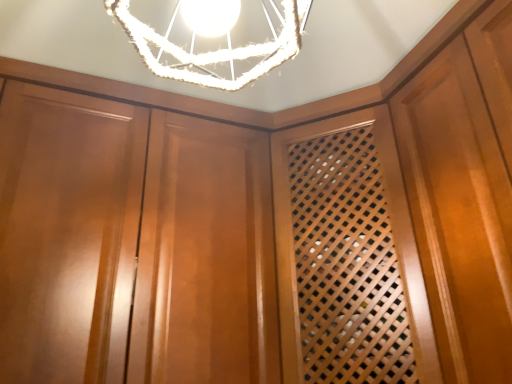
Measure the distance between point (277, 42) and camera.

Point (277, 42) is 39.13 inches away from camera.

Describe the element at coordinates (217, 50) in the screenshot. This screenshot has height=384, width=512. I see `white textured lampshade at upper center` at that location.

Where is `white textured lampshade at upper center`? This screenshot has height=384, width=512. white textured lampshade at upper center is located at coordinates (217, 50).

The image size is (512, 384). I want to click on glossy wood cabinetry at center, so click(132, 245).

What do you see at coordinates (132, 245) in the screenshot? I see `glossy wood cabinetry at center` at bounding box center [132, 245].

In order to face glossy wood cabinetry at center, should I rotate leftwards or rightwards?

Rotate left and turn 16.931 degrees.

At what (x,y) coordinates should I click in order to perform the action: click on white textured lampshade at upper center. Please return your answer as a coordinate pair (x, y). Looking at the image, I should click on (217, 50).

Visually, is glossy wood cabinetry at center positioned to the left or to the right of white textured lampshade at upper center?

Based on their positions, glossy wood cabinetry at center is located to the left of white textured lampshade at upper center.

Considering the relative positions of glossy wood cabinetry at center and white textured lampshade at upper center in the image provided, is glossy wood cabinetry at center behind white textured lampshade at upper center?

Yes, glossy wood cabinetry at center is behind white textured lampshade at upper center.

Is point (87, 243) positioned before point (218, 79)?

No, (87, 243) is further to viewer.

From the image's perspective, is glossy wood cabinetry at center beneath white textured lampshade at upper center?

Yes, from the image's perspective, glossy wood cabinetry at center is beneath white textured lampshade at upper center.

Consider the image. From a real-world perspective, between glossy wood cabinetry at center and white textured lampshade at upper center, who is vertically higher?

From a 3D spatial view, white textured lampshade at upper center is above.

Does glossy wood cabinetry at center have a lesser width compared to white textured lampshade at upper center?

In fact, glossy wood cabinetry at center might be wider than white textured lampshade at upper center.

Considering the sizes of glossy wood cabinetry at center and white textured lampshade at upper center in the image, is glossy wood cabinetry at center taller or shorter than white textured lampshade at upper center?

Clearly, glossy wood cabinetry at center is taller compared to white textured lampshade at upper center.

Does glossy wood cabinetry at center have a smaller size compared to white textured lampshade at upper center?

Incorrect, glossy wood cabinetry at center is not smaller in size than white textured lampshade at upper center.

Is glossy wood cabinetry at center completely or partially outside of white textured lampshade at upper center?

That's correct, glossy wood cabinetry at center is outside of white textured lampshade at upper center.

Would you say glossy wood cabinetry at center is a long distance from white textured lampshade at upper center?

glossy wood cabinetry at center is near white textured lampshade at upper center, not far away.

Does glossy wood cabinetry at center turn towards white textured lampshade at upper center?

Yes, glossy wood cabinetry at center is oriented towards white textured lampshade at upper center.

What's the angular difference between glossy wood cabinetry at center and white textured lampshade at upper center's facing directions?

The angle between the facing direction of glossy wood cabinetry at center and the facing direction of white textured lampshade at upper center is 0.663 degrees.

How much distance is there between glossy wood cabinetry at center and white textured lampshade at upper center?

The distance of glossy wood cabinetry at center from white textured lampshade at upper center is 47.63 centimeters.

Find the location of a particular element. This screenshot has width=512, height=384. cabinetry that appears behind the white textured lampshade at upper center is located at coordinates [x=132, y=245].

Visually, is white textured lampshade at upper center positioned to the left or to the right of glossy wood cabinetry at center?

Based on their positions, white textured lampshade at upper center is located to the right of glossy wood cabinetry at center.

Which object is closer to the camera taking this photo, white textured lampshade at upper center or glossy wood cabinetry at center?

white textured lampshade at upper center is more forward.

Considering the points (162, 67) and (37, 300), which point is in front, point (162, 67) or point (37, 300)?

The point (37, 300) is in front.

From the image's perspective, which one is positioned lower, white textured lampshade at upper center or glossy wood cabinetry at center?

glossy wood cabinetry at center appears lower in the image.

From a real-world perspective, who is located lower, white textured lampshade at upper center or glossy wood cabinetry at center?

From a 3D spatial view, glossy wood cabinetry at center is below.

Which of these two, white textured lampshade at upper center or glossy wood cabinetry at center, is wider?

Wider between the two is glossy wood cabinetry at center.

Which of these two, white textured lampshade at upper center or glossy wood cabinetry at center, stands taller?

glossy wood cabinetry at center is taller.

Looking at this image, based on their sizes in the image, would you say white textured lampshade at upper center is bigger or smaller than glossy wood cabinetry at center?

Clearly, white textured lampshade at upper center is smaller in size than glossy wood cabinetry at center.

Is white textured lampshade at upper center completely or partially outside of glossy wood cabinetry at center?

Yes.

Is white textured lampshade at upper center next to glossy wood cabinetry at center and touching it?

No, white textured lampshade at upper center is not touching glossy wood cabinetry at center.

Is white textured lampshade at upper center facing away from glossy wood cabinetry at center?

Yes, white textured lampshade at upper center is positioned with its back facing glossy wood cabinetry at center.

Image resolution: width=512 pixels, height=384 pixels. Find the location of `cabinetry below the white textured lampshade at upper center (from the image's perspective)`. cabinetry below the white textured lampshade at upper center (from the image's perspective) is located at coordinates (132, 245).

Locate an element on the screen. lamp that appears on the right of glossy wood cabinetry at center is located at coordinates (x=217, y=50).

This screenshot has width=512, height=384. I want to click on lamp that is above the glossy wood cabinetry at center (from a real-world perspective), so click(217, 50).